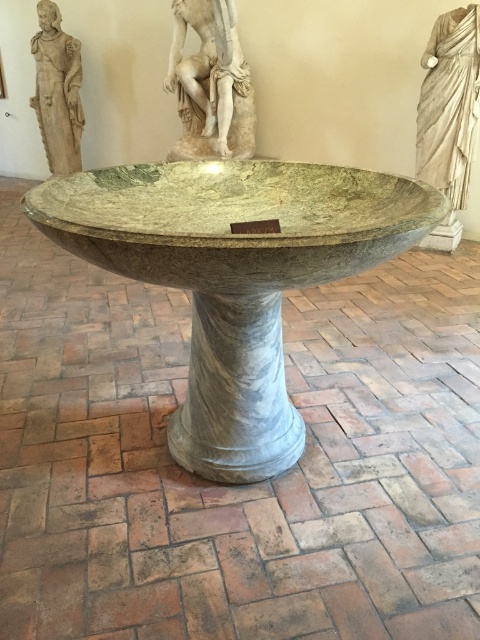
Question: Does green marble bowl at center appear on the right side of marble column at center?

Choices:
 (A) no
 (B) yes

Answer: (A)

Question: Which point is farther from the camera taking this photo?

Choices:
 (A) (460, 195)
 (B) (274, 342)

Answer: (A)

Question: Based on their relative distances, which object is farther from the white marble draped cloth at upper right?

Choices:
 (A) marble statue at upper left
 (B) green marble bowl at center
 (C) white marble statue at upper center
 (D) marble column at center

Answer: (A)

Question: Estimate the real-world distances between objects in this image. Which object is farther from the white marble statue at upper center?

Choices:
 (A) marble statue at upper left
 (B) green marble bowl at center
 (C) white marble draped cloth at upper right
 (D) marble column at center

Answer: (D)

Question: Is white marble statue at upper center further to camera compared to white marble draped cloth at upper right?

Choices:
 (A) no
 (B) yes

Answer: (B)

Question: Where is green marble bowl at center located in relation to white marble statue at upper center in the image?

Choices:
 (A) left
 (B) right

Answer: (B)